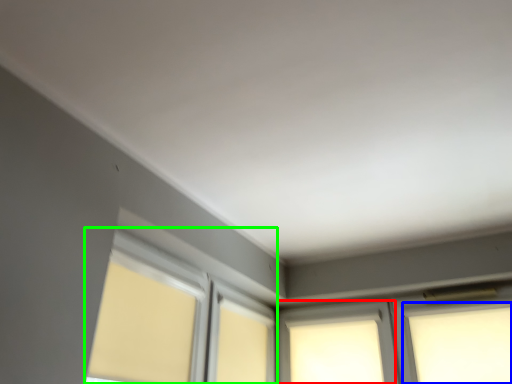
Question: Which is farther away from window (highlighted by a red box)? window (highlighted by a blue box) or bay window (highlighted by a green box)?

Choices:
 (A) window
 (B) bay window

Answer: (B)